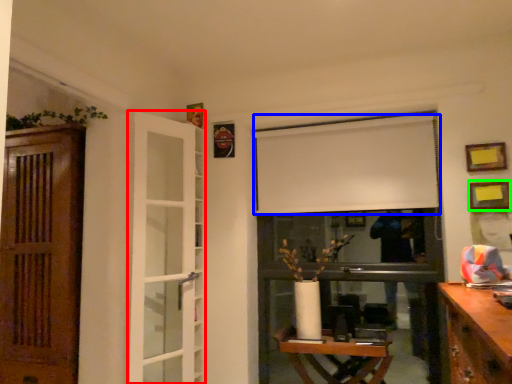
Question: Estimate the real-world distances between objects in this image. Which object is farther from door (highlighted by a red box), curtain (highlighted by a blue box) or picture frame (highlighted by a green box)?

Choices:
 (A) curtain
 (B) picture frame

Answer: (B)